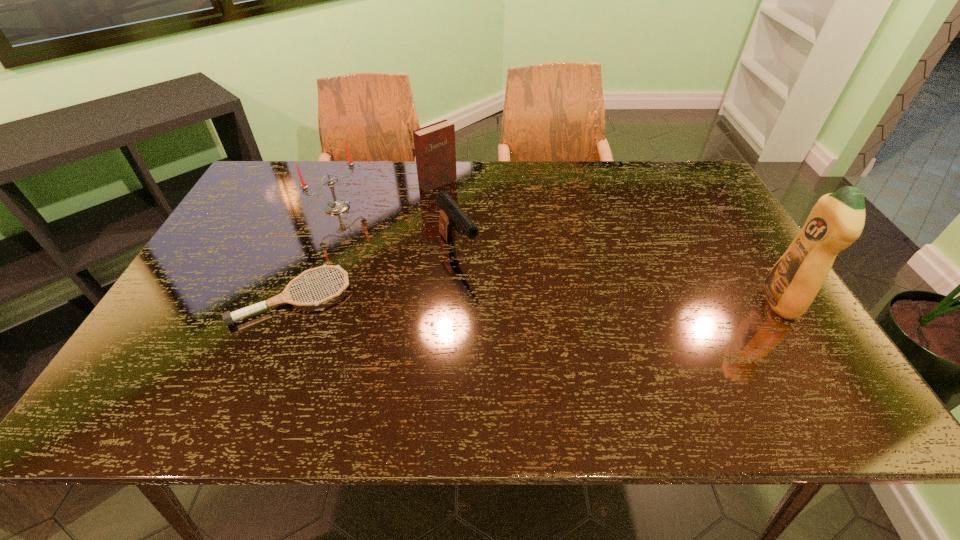
Find the location of `vacant region located 0.200m at the barrel of the second shortest object`. vacant region located 0.200m at the barrel of the second shortest object is located at coordinates (508, 323).

You are a GUI agent. You are given a task and a screenshot of the screen. Output one action in this format:
    pyautogui.click(x=<x>, y=<y>)
    Task: Click on the vacant space located 0.340m at the barrel of the second shortest object
    The image size is (960, 540).
    Given the screenshot: What is the action you would take?
    tap(542, 368)

The height and width of the screenshot is (540, 960). What are the coordinates of `free space located at the barrel of the second shortest object` in the screenshot? It's located at (496, 309).

Where is `vacant area located on the front-facing side of the candle`? The width and height of the screenshot is (960, 540). vacant area located on the front-facing side of the candle is located at coordinates (371, 228).

Where is `free space located on the front-facing side of the candle`? free space located on the front-facing side of the candle is located at coordinates (423, 260).

The height and width of the screenshot is (540, 960). I want to click on vacant space situated 0.250m on the front-facing side of the candle, so click(x=410, y=252).

This screenshot has width=960, height=540. Identify the location of vacant space located 0.120m on the front cover of the diary. click(x=472, y=208).

You are a GUI agent. You are given a task and a screenshot of the screen. Output one action in this format:
    pyautogui.click(x=<x>, y=<y>)
    Task: Click on the vacant space situated 0.350m on the front cover of the diary
    
    Given the screenshot: What is the action you would take?
    pyautogui.click(x=523, y=247)

Where is `vacant region located 0.160m on the front cover of the diary`? This screenshot has width=960, height=540. vacant region located 0.160m on the front cover of the diary is located at coordinates (480, 214).

The width and height of the screenshot is (960, 540). I want to click on candle that is at the far edge, so click(336, 206).